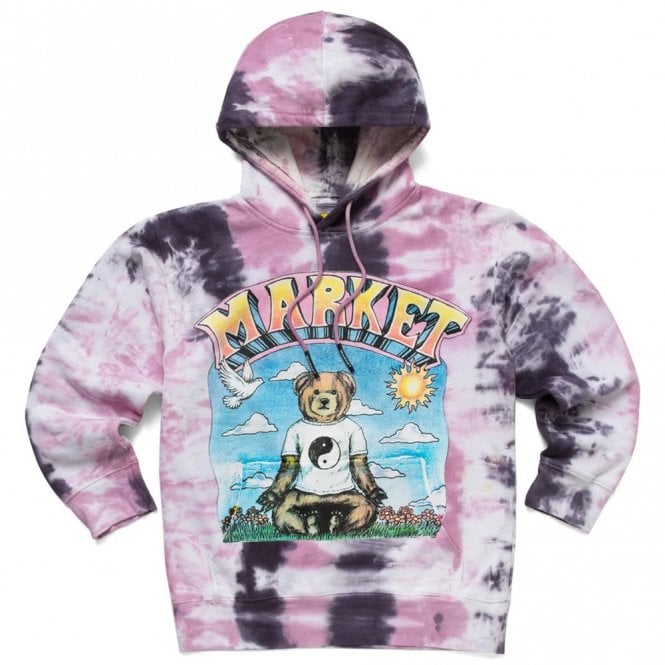
Identify the location of hood. This screenshot has width=665, height=665. (315, 80).